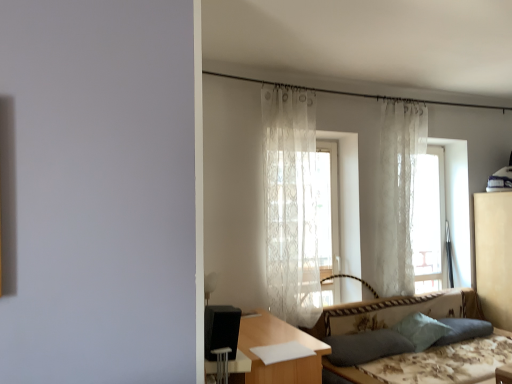
The image size is (512, 384). In order to click on free region under white lace curtain at right, positioned as the second curtain in front-to-back order (from a real-world perspective) in this screenshot , I will do `click(412, 299)`.